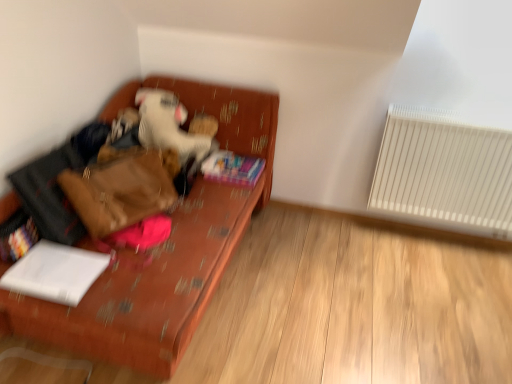
The height and width of the screenshot is (384, 512). In order to click on vacant space underneath white plastic radiator at right (from a real-world perspective) in this screenshot , I will do `click(433, 238)`.